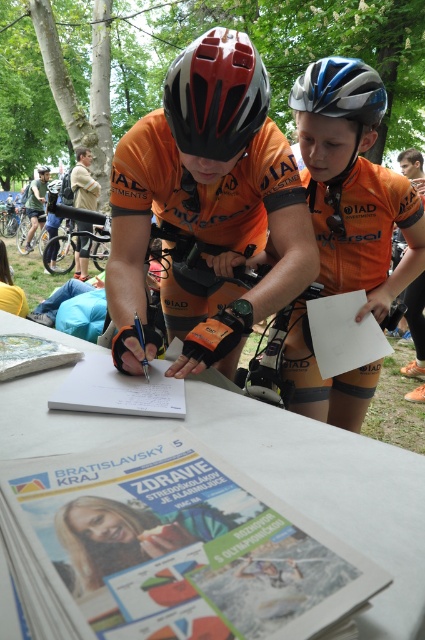
Measure the distance from orange jersey at center to silver/glossy bicycle helmet at upper center.

orange jersey at center is 20.79 inches from silver/glossy bicycle helmet at upper center.

Is orange jersey at center wider than silver/glossy bicycle helmet at upper center?

Correct, the width of orange jersey at center exceeds that of silver/glossy bicycle helmet at upper center.

Does point (249, 120) come behind point (365, 122)?

No, (249, 120) is in front of (365, 122).

Locate an element on the screen. The image size is (425, 640). orange jersey at center is located at coordinates (206, 193).

Measure the distance between light brown leather jacket at upper left and camera.

light brown leather jacket at upper left is 7.76 meters away from camera.

Does light brown leather jacket at upper left lie behind matte black helmet at upper center?

No, light brown leather jacket at upper left is in front of matte black helmet at upper center.

The height and width of the screenshot is (640, 425). Find the location of `light brown leather jacket at upper left`. light brown leather jacket at upper left is located at coordinates (84, 180).

You are a GUI agent. You are given a task and a screenshot of the screen. Output one action in this format:
    pyautogui.click(x=<x>, y=<y>)
    Task: Click on the light brown leather jacket at upper left
    The width and height of the screenshot is (425, 640).
    Given the screenshot: What is the action you would take?
    pyautogui.click(x=84, y=180)

Does orange jersey at center have a greater height compared to light brown leather jacket at upper left?

No, orange jersey at center is not taller than light brown leather jacket at upper left.

Is point (263, 161) farther from camera compared to point (90, 173)?

No, (263, 161) is closer to viewer.

Is point (142, 262) farther from camera compared to point (87, 148)?

No, it is in front of (87, 148).

The width and height of the screenshot is (425, 640). Find the location of `orange jersey at center`. orange jersey at center is located at coordinates (206, 193).